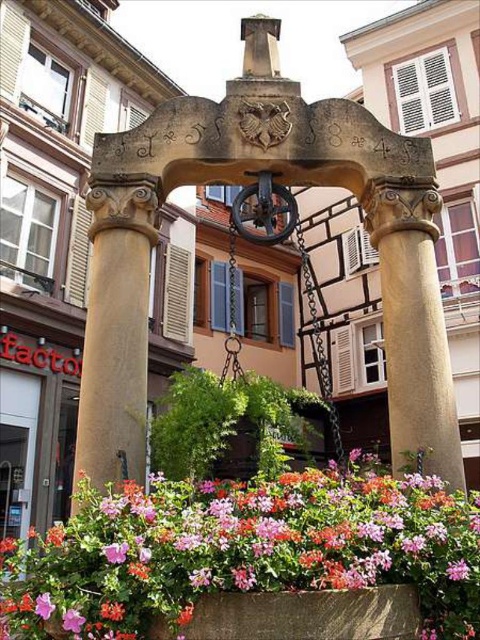
You are a gardener who wants to water the pink matte flower at center and the matte stone flower box at lower center. Which one is located higher up in the image?

The pink matte flower at center is positioned over the matte stone flower box at lower center, so it is higher up.